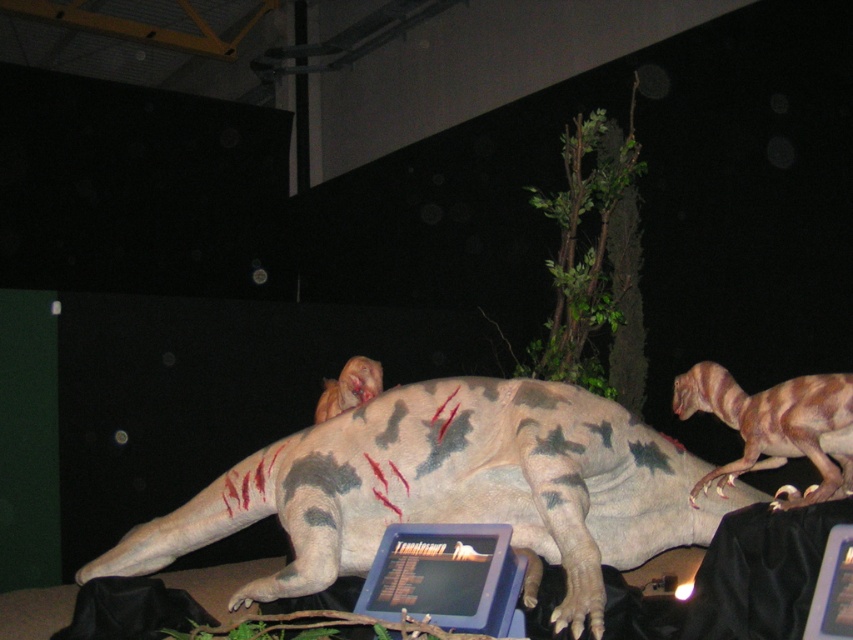
You are an exhibit designer arranging two dinosaur models in a museum. You have the brown textured dinosaur at right and the brown textured dinosaur head at center. Which one should you place higher to ensure they are displayed at the same eye level?

To ensure both the brown textured dinosaur at right and the brown textured dinosaur head at center are displayed at the same eye level, you should place the brown textured dinosaur at right lower because it is taller than the brown textured dinosaur head at center.

You are a visitor at the museum and want to take a photo of the brown textured dinosaur at right without the blue plastic laptop at center appearing in the frame. Is it possible to do so by adjusting your camera angle?

The brown textured dinosaur at right is above the blue plastic laptop at center, so by angling the camera upwards to focus on the higher position of the brown textured dinosaur at right, you can exclude the blue plastic laptop at center from the frame.